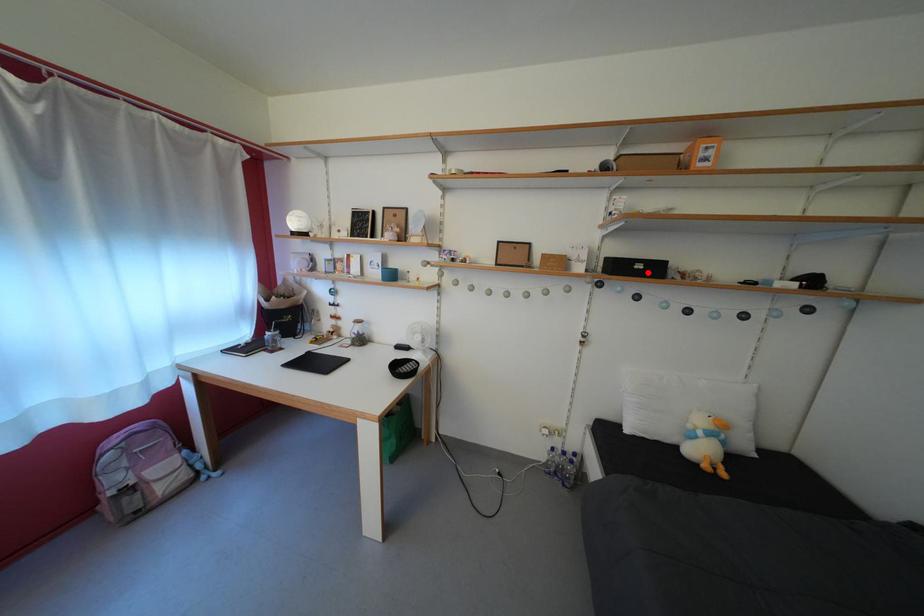
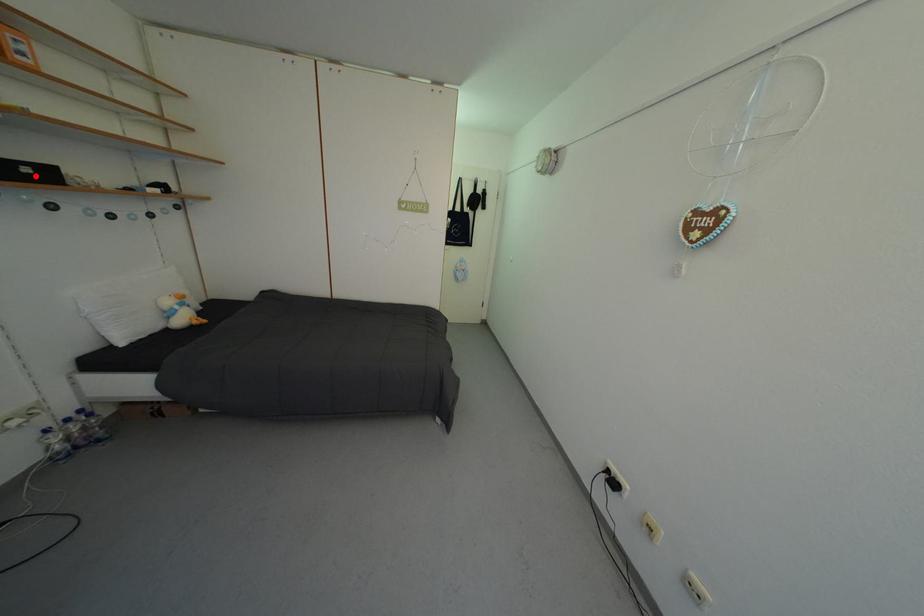
I am providing you with two images of the same scene from different viewpoints. A red point is marked on the first image and another point is marked on the second image. Is the red point in image1 aligned with the point shown in image2?

Yes